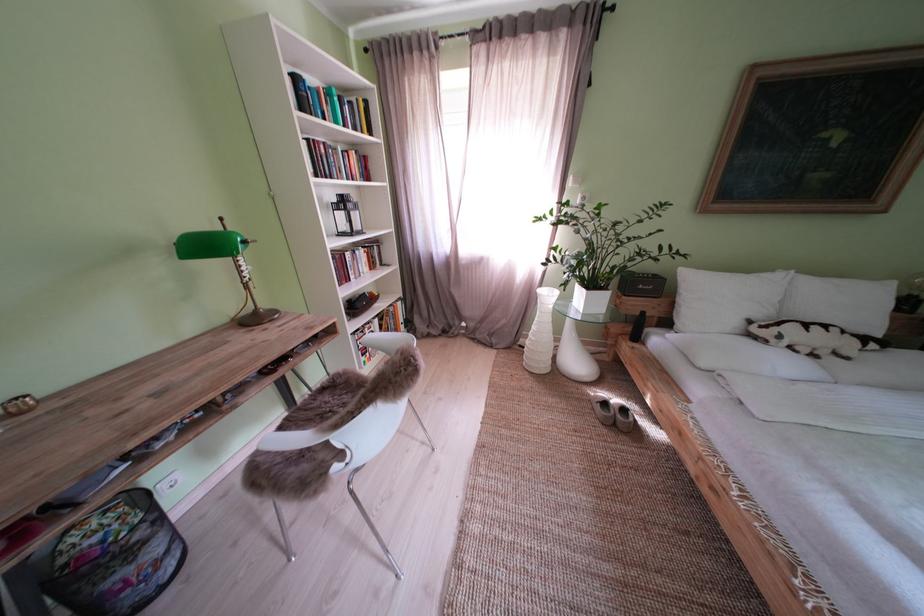
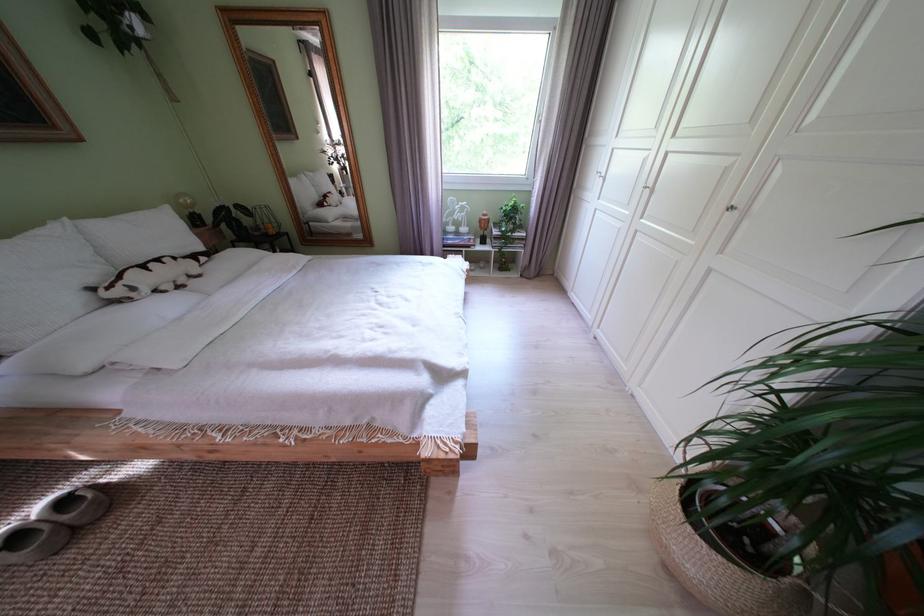
Locate, in the second image, the point that corresponds to the point at 616,408 in the first image.

(28, 543)